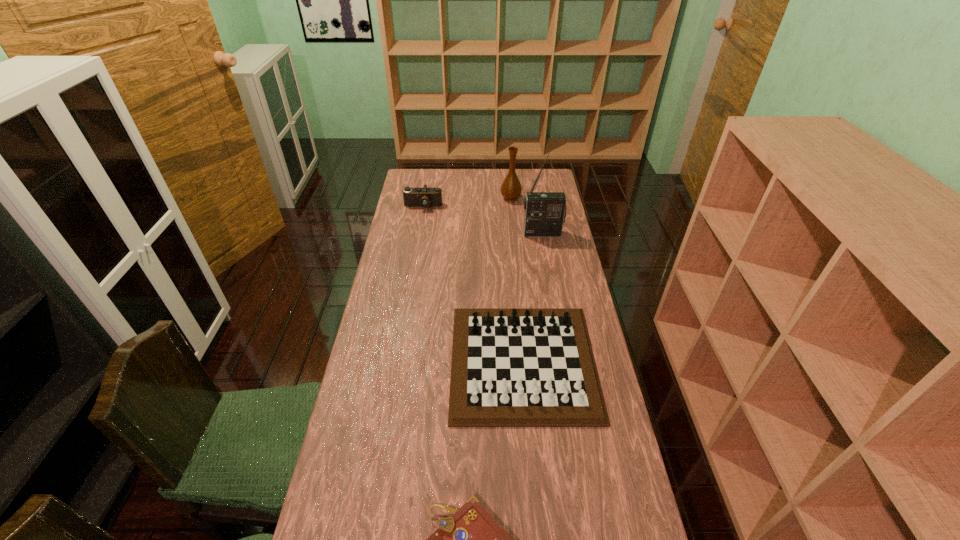
At what (x,y) coordinates should I click in order to perform the action: click on object present at the left edge. Please return your answer as a coordinate pair (x, y). This screenshot has height=540, width=960. Looking at the image, I should click on (424, 197).

You are a GUI agent. You are given a task and a screenshot of the screen. Output one action in this format:
    pyautogui.click(x=<x>, y=<y>)
    Task: Click on the radio receiver that is at the right edge
    
    Given the screenshot: What is the action you would take?
    pyautogui.click(x=545, y=212)

You are a GUI agent. You are given a task and a screenshot of the screen. Output one action in this format:
    pyautogui.click(x=<x>, y=<y>)
    Task: Click on the gameboard present at the right edge
    The width and height of the screenshot is (960, 540).
    Given the screenshot: What is the action you would take?
    514,367

Locate an element on the screen. The image size is (960, 540). free region at the far edge is located at coordinates (468, 178).

Locate an element on the screen. free region at the left edge of the desktop is located at coordinates (385, 519).

Find the location of `free region at the right edge of the desktop`. free region at the right edge of the desktop is located at coordinates (612, 503).

Where is `free space at the far right corner`? The height and width of the screenshot is (540, 960). free space at the far right corner is located at coordinates (533, 173).

Where is `vacant area that lies between the camera and the gameboard`? This screenshot has width=960, height=540. vacant area that lies between the camera and the gameboard is located at coordinates (473, 284).

At what (x,y) coordinates should I click in order to perform the action: click on empty location between the vase and the camera. Please return your answer as a coordinate pair (x, y). The height and width of the screenshot is (540, 960). Looking at the image, I should click on (467, 202).

This screenshot has width=960, height=540. Identify the location of free space between the camera and the fourth shortest object. (467, 202).